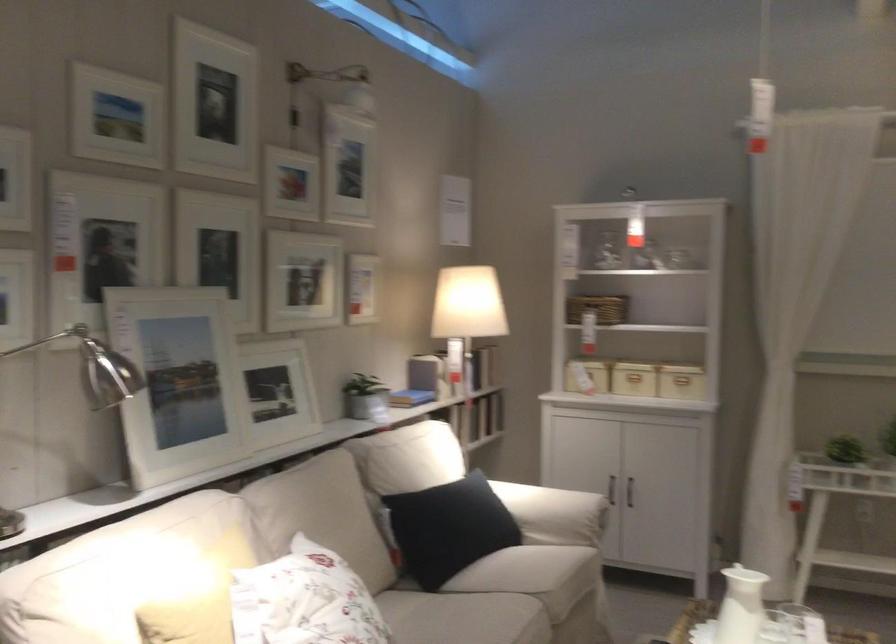
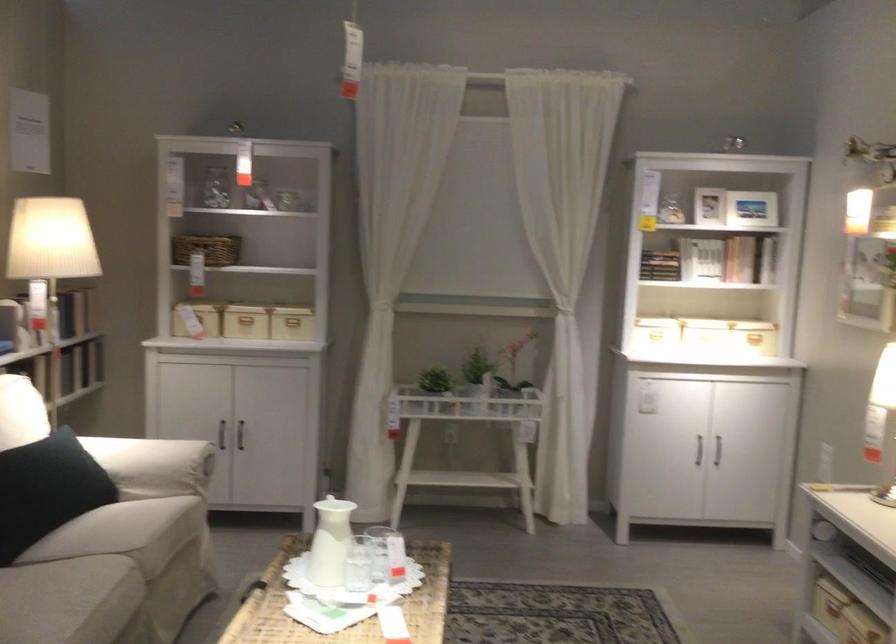
Locate, in the second image, the point that corresponds to (555,511) in the first image.

(152, 465)